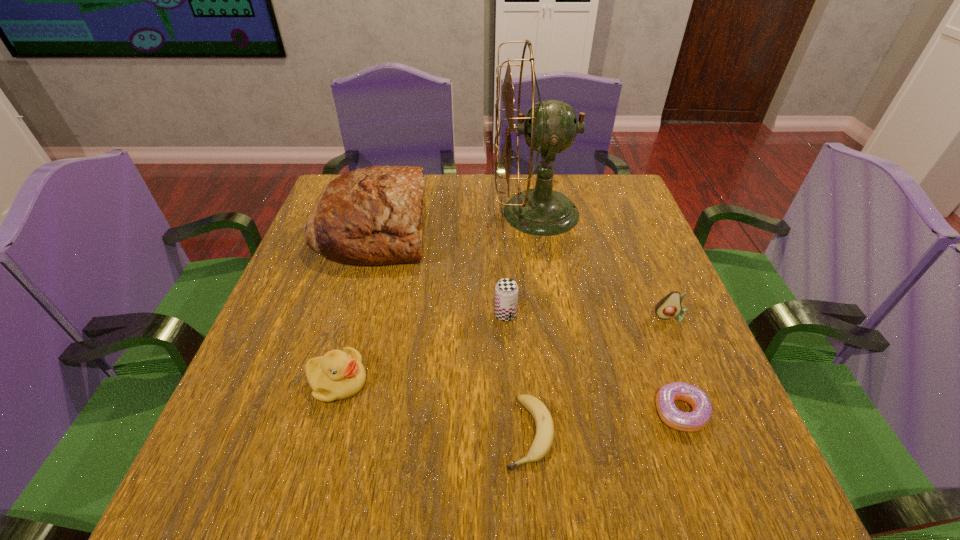
Identify the location of duckling at the left edge. (338, 375).

The height and width of the screenshot is (540, 960). In order to click on avocado present at the right edge in this screenshot , I will do `click(668, 307)`.

The height and width of the screenshot is (540, 960). Identify the location of doughnut that is positioned at the right edge. (696, 420).

Locate an element on the screen. The width and height of the screenshot is (960, 540). object at the far left corner is located at coordinates (370, 216).

In the image, there is a desktop. Where is `vacant space at the far edge`? The width and height of the screenshot is (960, 540). vacant space at the far edge is located at coordinates (488, 180).

Where is `blank space at the near edge of the desktop`? This screenshot has height=540, width=960. blank space at the near edge of the desktop is located at coordinates (447, 479).

Locate an element on the screen. vacant space at the left edge of the desktop is located at coordinates click(x=279, y=306).

What are the coordinates of `vacant area at the right edge of the desktop` in the screenshot? It's located at (628, 359).

This screenshot has width=960, height=540. In order to click on free space at the far right corner of the desktop in this screenshot , I will do `click(588, 180)`.

The height and width of the screenshot is (540, 960). In order to click on unoccupied position between the bread and the duckling in this screenshot , I will do `click(356, 305)`.